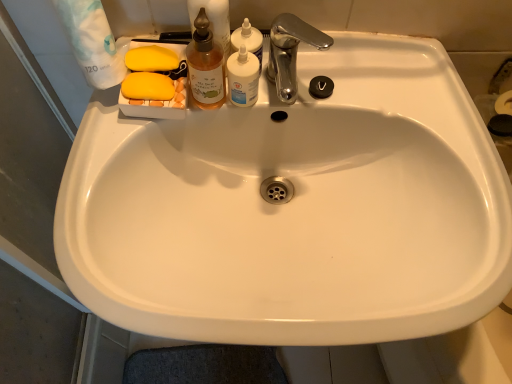
This screenshot has width=512, height=384. Find the location of `free point to the right of translucent plastic bottle at upper center, the second cleaning product from the left`. free point to the right of translucent plastic bottle at upper center, the second cleaning product from the left is located at coordinates (364, 77).